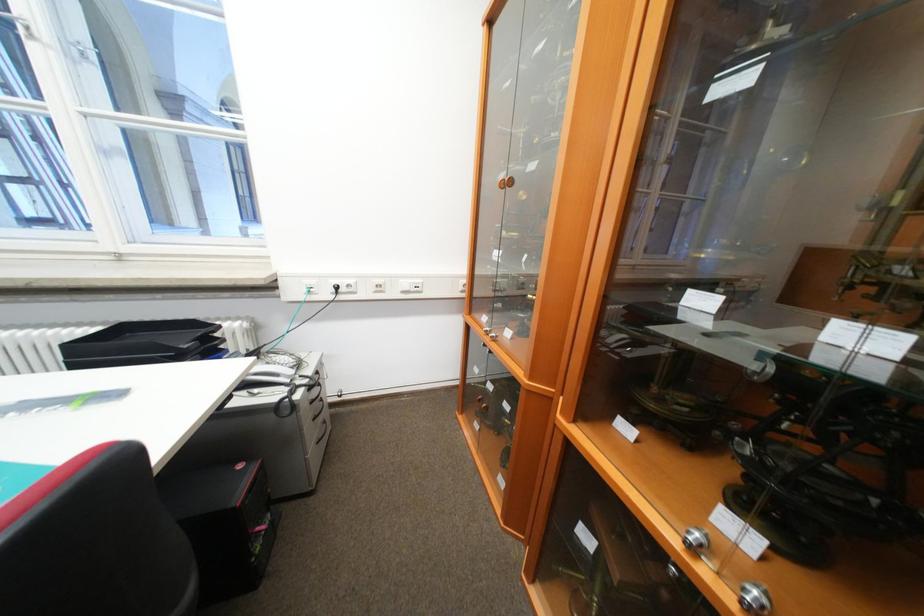
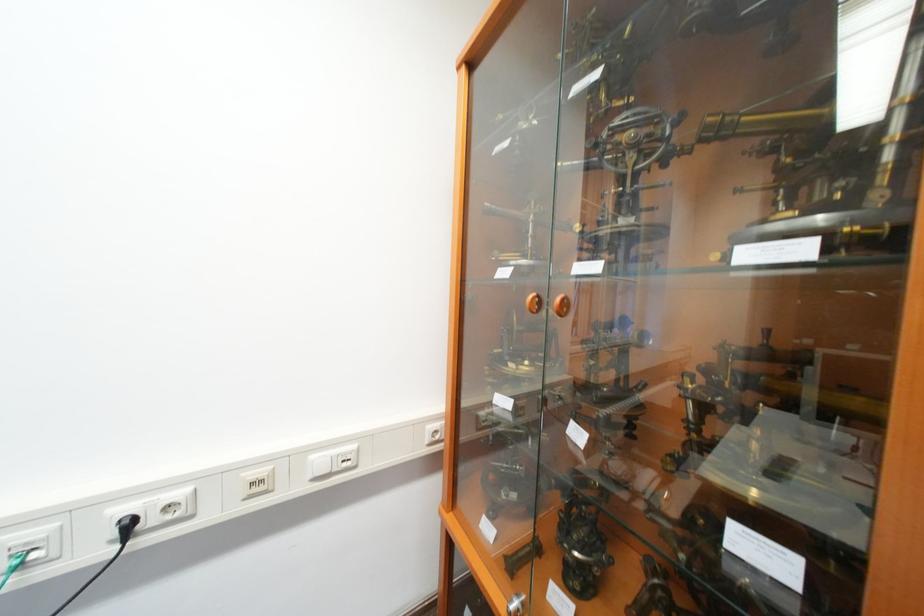
Question: The images are taken continuously from a first-person perspective. In which direction are you moving?

Choices:
 (A) Left
 (B) Right
 (C) Forward
 (D) Backward

Answer: (C)